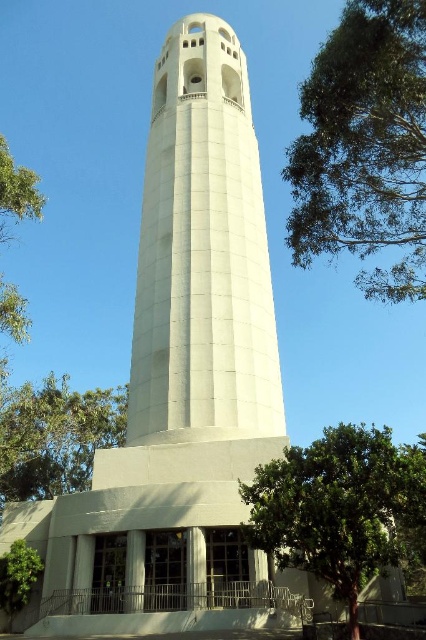
Which is behind, point (241, 346) or point (94, 404)?

The point (94, 404) is more distant.

At what (x,y) coordinates should I click in order to perform the action: click on white concrete tower at center. Please return your answer as a coordinate pair (x, y). Looking at the image, I should click on (203, 253).

In the scene shown: Is white concrete tower at center above green leafy tree at lower left?

Yes.

Consider the image. Is white concrete tower at center taller than green leafy tree at lower left?

Yes, white concrete tower at center is taller than green leafy tree at lower left.

Is point (152, 292) closer to camera compared to point (117, 445)?

Yes, it is in front of point (117, 445).

I want to click on white concrete tower at center, so click(203, 253).

Does point (304, 192) come behind point (66, 394)?

No, (304, 192) is in front of (66, 394).

Between point (417, 109) and point (46, 456), which one is positioned behind?

Point (46, 456)

Does point (367, 40) lie behind point (118, 438)?

No, it is in front of (118, 438).

Locate an element on the screen. The width and height of the screenshot is (426, 640). green leafy tree at upper right is located at coordinates (365, 147).